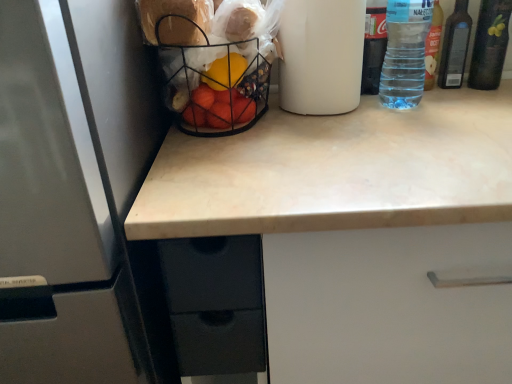
Question: Should I look upward or downward to see dark green glass bottle at upper right, which is the 4th bottle in left-to-right order?

Choices:
 (A) up
 (B) down

Answer: (A)

Question: Should I look upward or downward to see satin white refrigerator at left?

Choices:
 (A) up
 (B) down

Answer: (B)

Question: Can you confirm if transparent plastic bottle at upper right, the fourth bottle when ordered from right to left, is smaller than satin white refrigerator at left?

Choices:
 (A) yes
 (B) no

Answer: (A)

Question: Can you confirm if transparent plastic bottle at upper right, which ranks as the 1th bottle in left-to-right order, is wider than satin white refrigerator at left?

Choices:
 (A) yes
 (B) no

Answer: (B)

Question: Is there a large distance between transparent plastic bottle at upper right, which ranks as the 1th bottle in left-to-right order, and satin white refrigerator at left?

Choices:
 (A) yes
 (B) no

Answer: (B)

Question: Does transparent plastic bottle at upper right, the fourth bottle when ordered from right to left, have a lesser height compared to satin white refrigerator at left?

Choices:
 (A) yes
 (B) no

Answer: (A)

Question: Are transparent plastic bottle at upper right, the fourth bottle when ordered from right to left, and satin white refrigerator at left beside each other?

Choices:
 (A) yes
 (B) no

Answer: (B)

Question: From a real-world perspective, does transparent plastic bottle at upper right, which ranks as the 1th bottle in left-to-right order, stand above satin white refrigerator at left?

Choices:
 (A) yes
 (B) no

Answer: (A)

Question: Is transparent plastic bottle at upper right, which ranks as the 1th bottle in left-to-right order, bigger than clear plastic bottle at upper right, the second bottle positioned from the right?

Choices:
 (A) yes
 (B) no

Answer: (A)

Question: Considering the relative sizes of transparent plastic bottle at upper right, the fourth bottle when ordered from right to left, and clear plastic bottle at upper right, positioned as the third bottle in left-to-right order, in the image provided, is transparent plastic bottle at upper right, the fourth bottle when ordered from right to left, shorter than clear plastic bottle at upper right, positioned as the third bottle in left-to-right order,?

Choices:
 (A) yes
 (B) no

Answer: (B)

Question: Can you confirm if transparent plastic bottle at upper right, which ranks as the 1th bottle in left-to-right order, is positioned to the right of clear plastic bottle at upper right, the second bottle positioned from the right?

Choices:
 (A) yes
 (B) no

Answer: (B)

Question: Is transparent plastic bottle at upper right, which ranks as the 1th bottle in left-to-right order, touching clear plastic bottle at upper right, positioned as the third bottle in left-to-right order?

Choices:
 (A) no
 (B) yes

Answer: (A)

Question: Considering the relative sizes of transparent plastic bottle at upper right, the fourth bottle when ordered from right to left, and clear plastic bottle at upper right, positioned as the third bottle in left-to-right order, in the image provided, is transparent plastic bottle at upper right, the fourth bottle when ordered from right to left, thinner than clear plastic bottle at upper right, positioned as the third bottle in left-to-right order,?

Choices:
 (A) no
 (B) yes

Answer: (A)

Question: Does transparent plastic bottle at upper right, which ranks as the 1th bottle in left-to-right order, have a smaller size compared to clear plastic bottle at upper right, the second bottle positioned from the right?

Choices:
 (A) no
 (B) yes

Answer: (A)

Question: Can you confirm if transparent plastic bottle at upper right, which ranks as the 1th bottle in left-to-right order, is taller than transparent plastic bottle at upper right, arranged as the 3th bottle when viewed from the right?

Choices:
 (A) no
 (B) yes

Answer: (A)